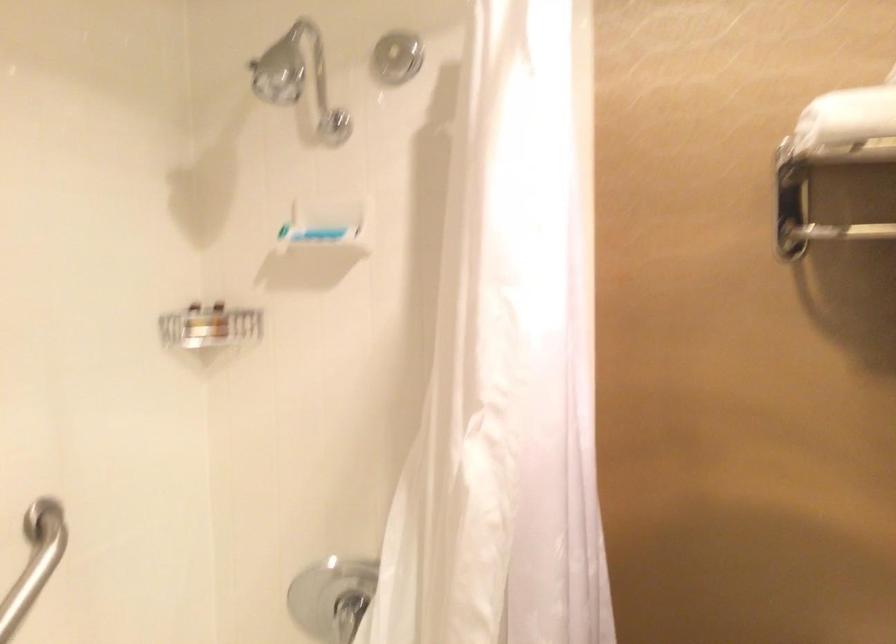
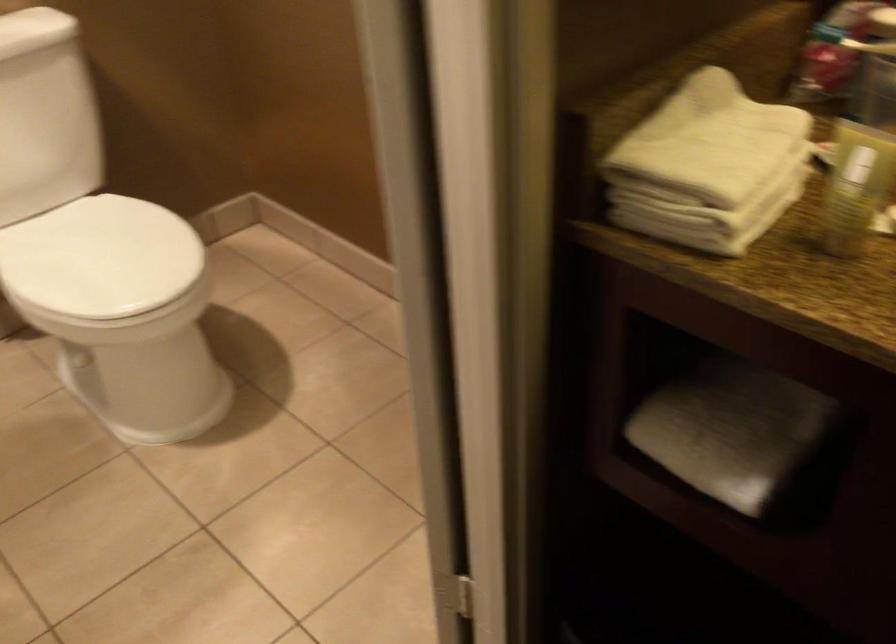
From the picture: The images are taken continuously from a first-person perspective. In which direction is your viewpoint rotating?

The camera's rotation is toward right-down.